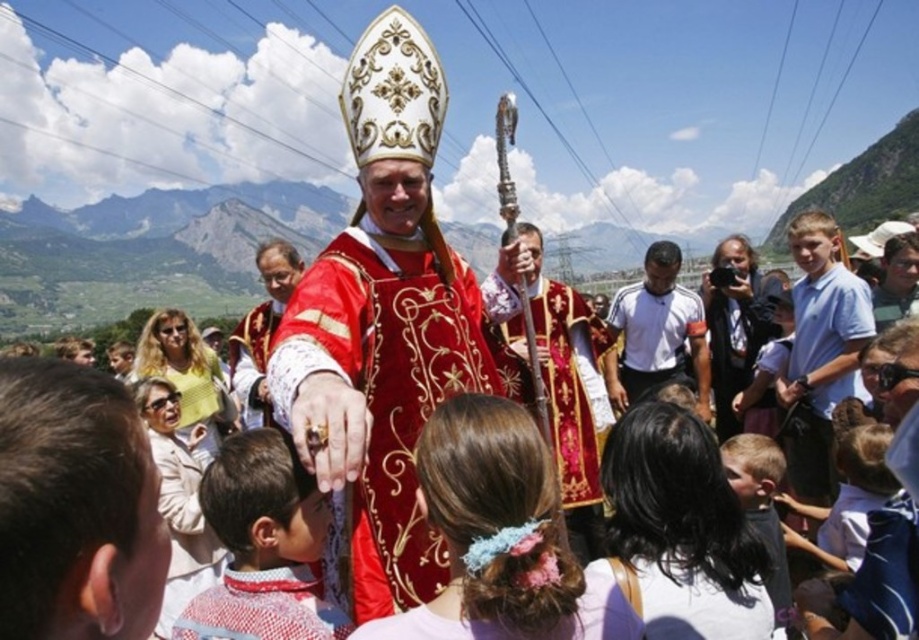
You are a photographer at the religious procession. You need to capture a photo where the gold embroidered robe at center and the matte white robe at center are both visible. Which robe should you position to the left side of your frame to ensure both are in the shot?

The gold embroidered robe at center is to the right of matte white robe at center. To include both in the shot, position the matte white robe at center on the left side of the frame so the gold embroidered robe at center naturally falls to its right within the frame.

You are an artist planning to paint this religious procession scene. You want to ensure the gold embroidered robe at center and the matte white robe at center are proportionally accurate. Based on the description, which robe should you depict as narrower in your painting?

The gold embroidered robe at center should be depicted as narrower since its width is less than the matte white robe at center.